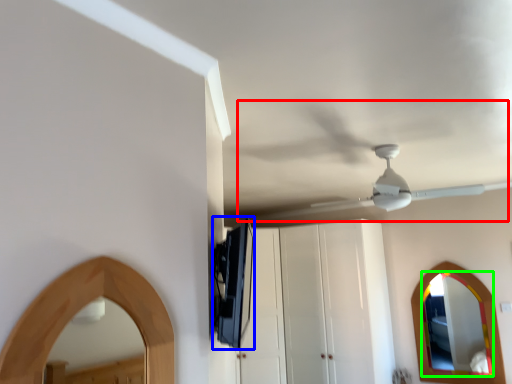
Question: Which is nearer to the fan (highlighted by a red box)? appliance (highlighted by a blue box) or mirror (highlighted by a green box).

Choices:
 (A) appliance
 (B) mirror

Answer: (A)